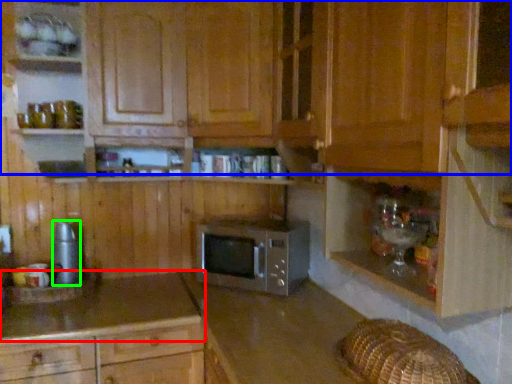
Question: Considering the real-world distances, which object is closest to countertop (highlighted by a red box)? cabinetry (highlighted by a blue box) or appliance (highlighted by a green box).

Choices:
 (A) cabinetry
 (B) appliance

Answer: (B)